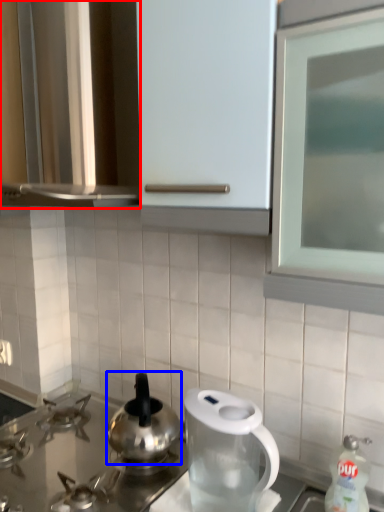
Question: Which object appears farthest to the camera in this image, cabinetry (highlighted by a red box) or kitchen appliance (highlighted by a blue box)?

Choices:
 (A) cabinetry
 (B) kitchen appliance

Answer: (B)